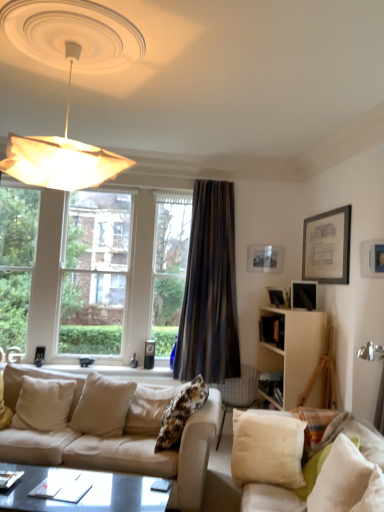
Image resolution: width=384 pixels, height=512 pixels. I want to click on vacant point above matte black coffee table at lower center (from a real-world perspective), so click(57, 487).